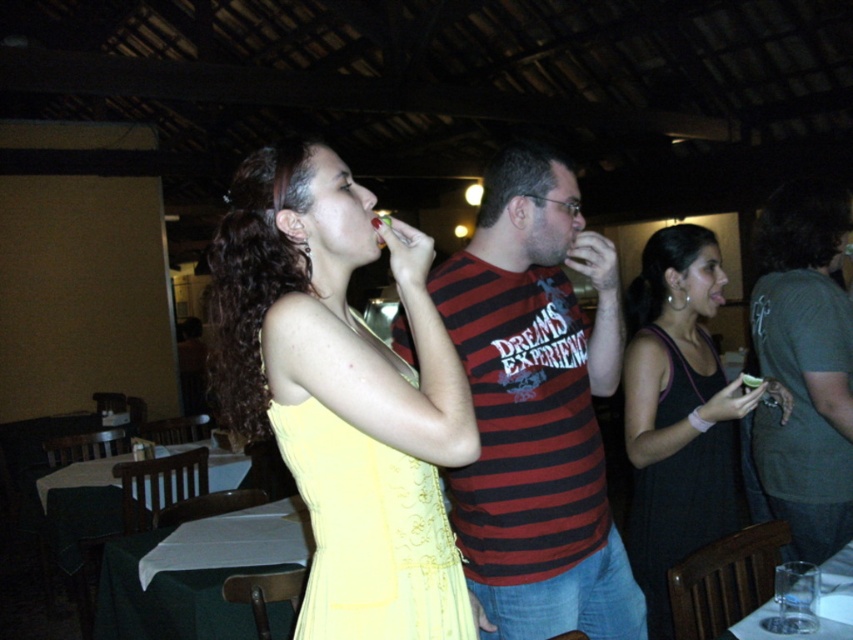
Question: Which point is farther from the camera taking this photo?

Choices:
 (A) (653, 259)
 (B) (798, 352)
 (C) (438, 552)
 (D) (550, 156)

Answer: (B)

Question: Among these points, which one is farthest from the camera?

Choices:
 (A) (363, 346)
 (B) (393, 632)
 (C) (596, 451)

Answer: (C)

Question: Which object is farther from the camera taking this photo?

Choices:
 (A) striped cotton shirt at center
 (B) black tank top at center

Answer: (B)

Question: Can you confirm if black tank top at center is positioned above yellow satin dress at center?

Choices:
 (A) no
 (B) yes

Answer: (A)

Question: Can you confirm if black tank top at center is smaller than yellow satin dress at center?

Choices:
 (A) yes
 (B) no

Answer: (B)

Question: Can you confirm if striped cotton shirt at center is thinner than black tank top at center?

Choices:
 (A) no
 (B) yes

Answer: (A)